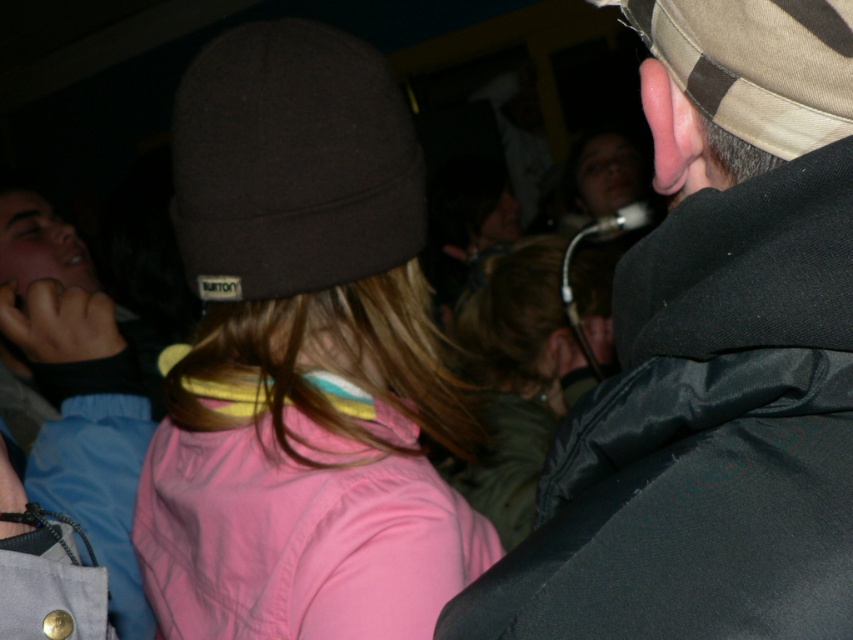
Which is in front, point (842, 128) or point (0, 220)?

Positioned in front is point (842, 128).

Between camouflage fabric cap at upper right and light blue denim jacket at left, which one has more height?

With more height is light blue denim jacket at left.

Which is behind, point (637, 461) or point (120, 573)?

The point (120, 573) is behind.

At what (x,y) coordinates should I click in order to perform the action: click on camouflage fabric cap at upper right. Please return your answer as a coordinate pair (x, y). The image size is (853, 640). Looking at the image, I should click on (712, 358).

Looking at this image, is camouflage fabric cap at upper right thinner than dark brown knit beanie at upper left?

Indeed, camouflage fabric cap at upper right has a lesser width compared to dark brown knit beanie at upper left.

Can you confirm if camouflage fabric cap at upper right is smaller than dark brown knit beanie at upper left?

Yes, camouflage fabric cap at upper right is smaller than dark brown knit beanie at upper left.

Does point (640, 513) lie in front of point (207, 195)?

Yes, point (640, 513) is in front of point (207, 195).

In order to click on camouflage fabric cap at upper right in this screenshot , I will do `click(712, 358)`.

Who is taller, dark brown knit beanie at upper left or light blue denim jacket at left?

light blue denim jacket at left is taller.

Locate an element on the screen. Image resolution: width=853 pixels, height=640 pixels. dark brown knit beanie at upper left is located at coordinates (292, 163).

This screenshot has width=853, height=640. What do you see at coordinates (292, 163) in the screenshot?
I see `dark brown knit beanie at upper left` at bounding box center [292, 163].

Identify the location of dark brown knit beanie at upper left. (292, 163).